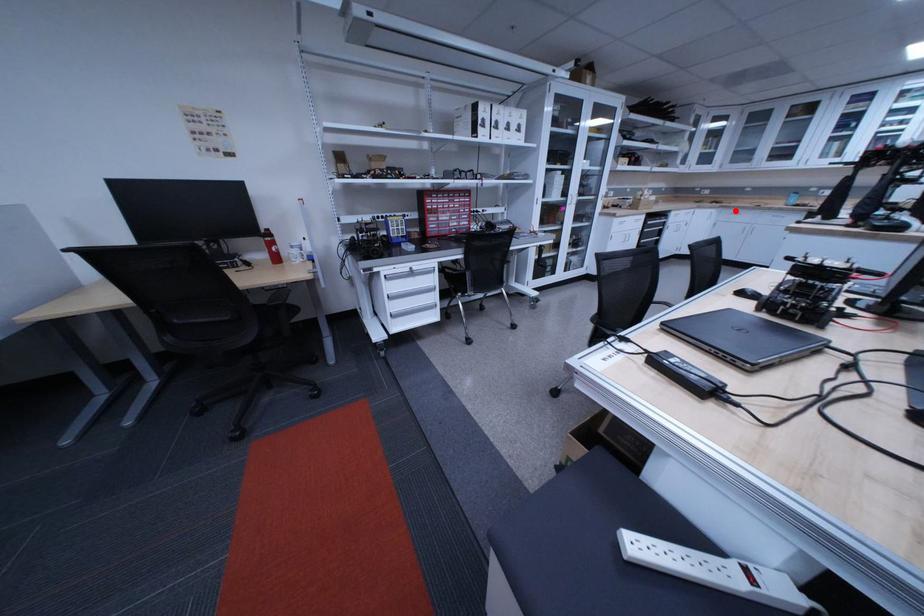
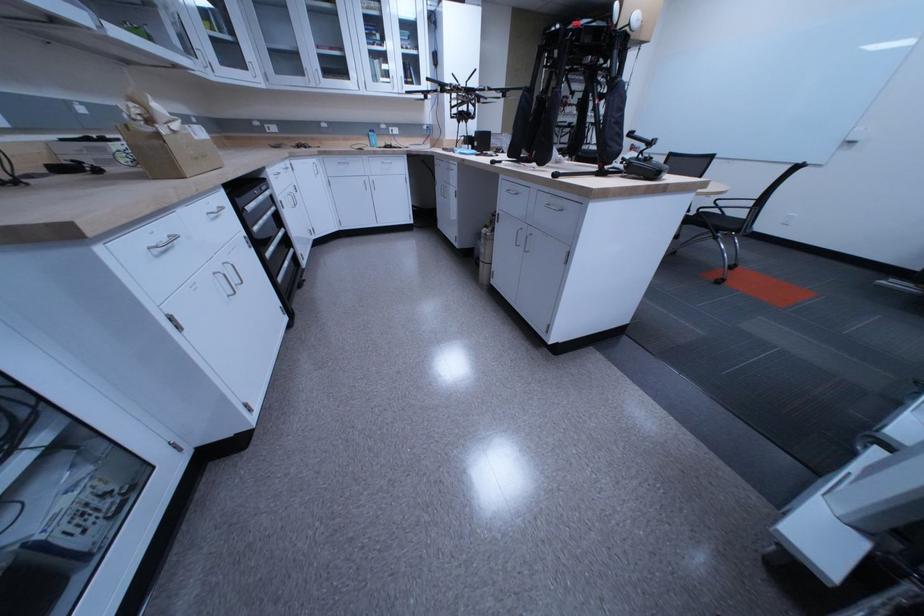
Question: A red point is marked in image1. In image2, is the corresponding 3D point closer to the camera or farther? Reply with the corresponding letter.

Choices:
 (A) The corresponding 3D point is closer.
 (B) The corresponding 3D point is farther.

Answer: (A)